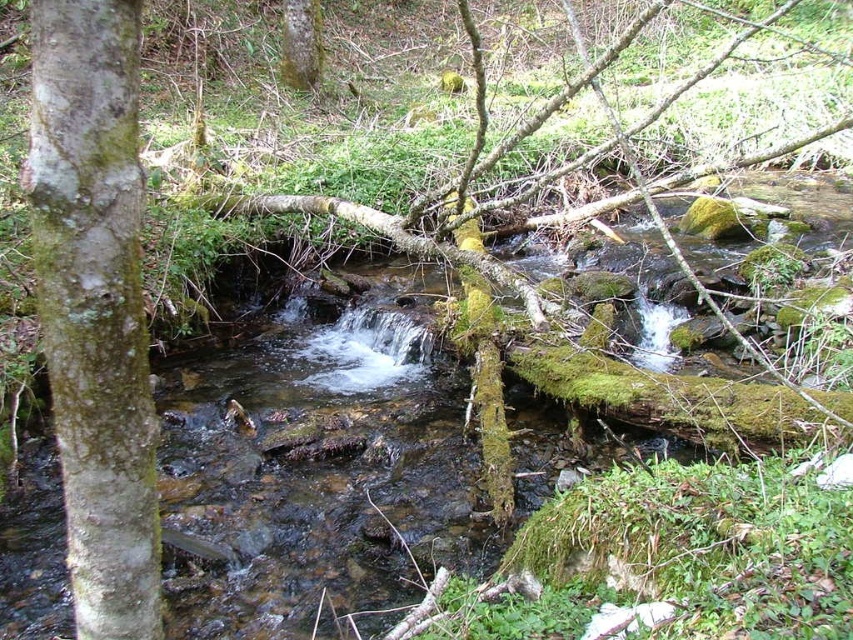
You are a hiker trying to cross the stream. You notice two mossy features in the scene. The green mossy bark at left and the green mossy tree trunk at upper center. Which one is narrower in width?

The green mossy bark at left is thinner than the green mossy tree trunk at upper center, so the green mossy bark at left is narrower in width.

You are a hiker trying to cross the stream using a fallen tree trunk. You see the green mossy bark at left and the green mossy tree trunk at upper center. Which one is closer to your current position on the bank?

The green mossy bark at left is closer to your current position on the bank because it is only 12.03 meters away from the green mossy tree trunk at upper center, but without knowing the exact location of the hiker, we cannot determine which is closer. However, since the question asks which is closer to the bank, the green mossy bark at left is likely closer as it is positioned on the left side of the frame near the bank.